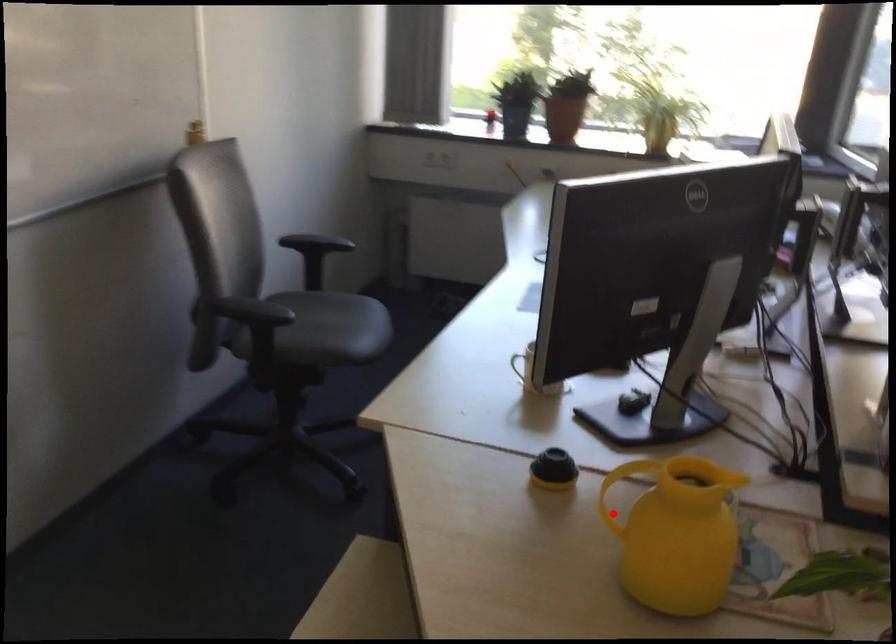
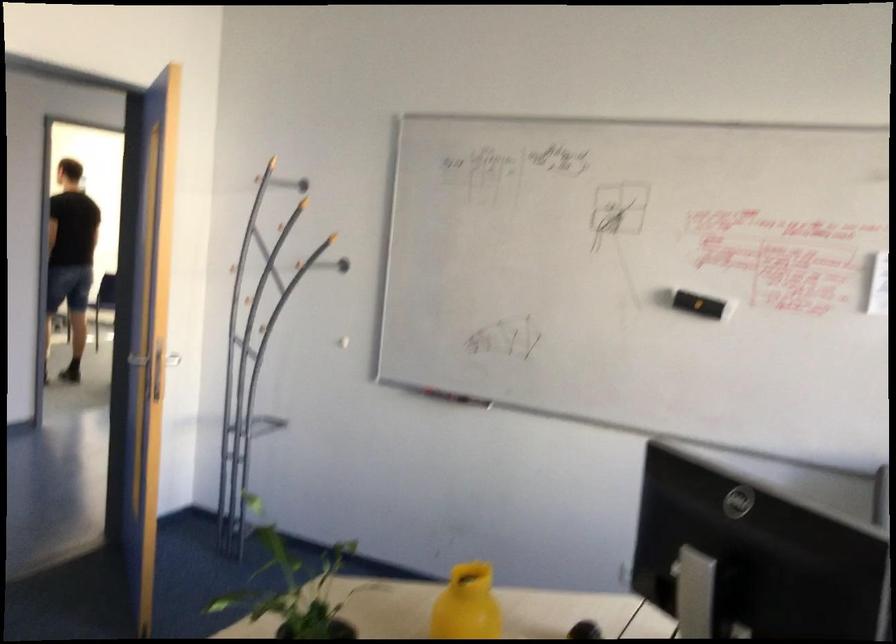
Question: I am providing you with two images of the same scene from different viewpoints. In image1, a red point is highlighted. Considering the same 3D point in image2, which of the following is correct?

Choices:
 (A) It is closer
 (B) It is farther

Answer: (B)